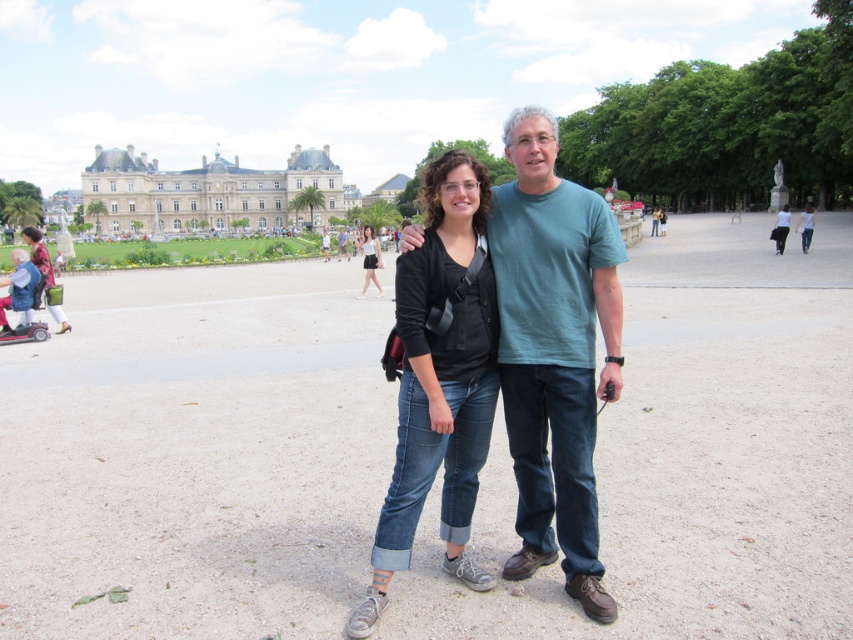
You are a photographer trying to capture a clear shot of both the denim jeans at center and the matte black top at center. Since you want to ensure both are visible, which object should you focus on first to account for their sizes?

The denim jeans at center is larger in size than the matte black top at center, so you should focus on the denim jeans at center first to ensure it is in clear focus before adjusting for the smaller matte black top at center.

You are a photographer trying to capture a candid shot of the two people in the park. You notice the denim jeans at center and the matte black top at center. Which clothing item is positioned in front of the other?

The denim jeans at center is closer to the viewer than the matte black top at center, so the denim jeans at center is positioned in front of the matte black top at center.

You are standing in the park scene and want to walk towards the two points marked in the image. Which point, point (534, 189) or point (129, 177), will you reach first?

Point (534, 189) is closer to the viewer than point (129, 177), so you will reach point (534, 189) first.